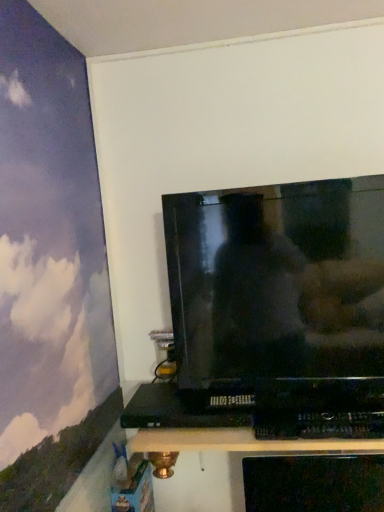
Question: Are black plastic dvd player at lower center and black plastic shelf at lower center beside each other?

Choices:
 (A) yes
 (B) no

Answer: (B)

Question: Is black plastic dvd player at lower center surrounding black plastic shelf at lower center?

Choices:
 (A) yes
 (B) no

Answer: (B)

Question: Is black plastic dvd player at lower center further to the viewer compared to black plastic shelf at lower center?

Choices:
 (A) yes
 (B) no

Answer: (A)

Question: Is black plastic dvd player at lower center located outside black plastic shelf at lower center?

Choices:
 (A) yes
 (B) no

Answer: (A)

Question: Is black plastic dvd player at lower center positioned before black plastic shelf at lower center?

Choices:
 (A) yes
 (B) no

Answer: (B)

Question: Considering the relative sizes of black plastic dvd player at lower center and black plastic shelf at lower center in the image provided, is black plastic dvd player at lower center smaller than black plastic shelf at lower center?

Choices:
 (A) no
 (B) yes

Answer: (B)

Question: Does black plastic shelf at lower center lie in front of black plastic dvd player at lower center?

Choices:
 (A) yes
 (B) no

Answer: (A)

Question: Does black plastic shelf at lower center appear on the right side of black plastic dvd player at lower center?

Choices:
 (A) yes
 (B) no

Answer: (A)

Question: From a real-world perspective, does black plastic shelf at lower center stand above black plastic dvd player at lower center?

Choices:
 (A) yes
 (B) no

Answer: (B)

Question: Is black plastic shelf at lower center with black plastic dvd player at lower center?

Choices:
 (A) yes
 (B) no

Answer: (B)

Question: Is black plastic shelf at lower center further to camera compared to black plastic dvd player at lower center?

Choices:
 (A) yes
 (B) no

Answer: (B)

Question: Is black plastic dvd player at lower center at the back of black plastic shelf at lower center?

Choices:
 (A) yes
 (B) no

Answer: (B)

Question: Is black plastic dvd player at lower center beside glossy black tv at upper center?

Choices:
 (A) no
 (B) yes

Answer: (A)